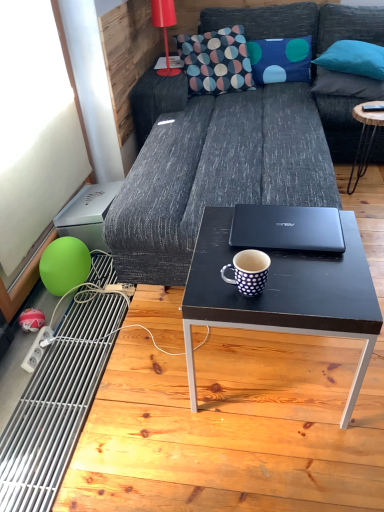
Where is `empty space that is ontop of black matte coffee table at center, which appears as the 1th coffee table when viewed from the front`? empty space that is ontop of black matte coffee table at center, which appears as the 1th coffee table when viewed from the front is located at coordinates (284, 249).